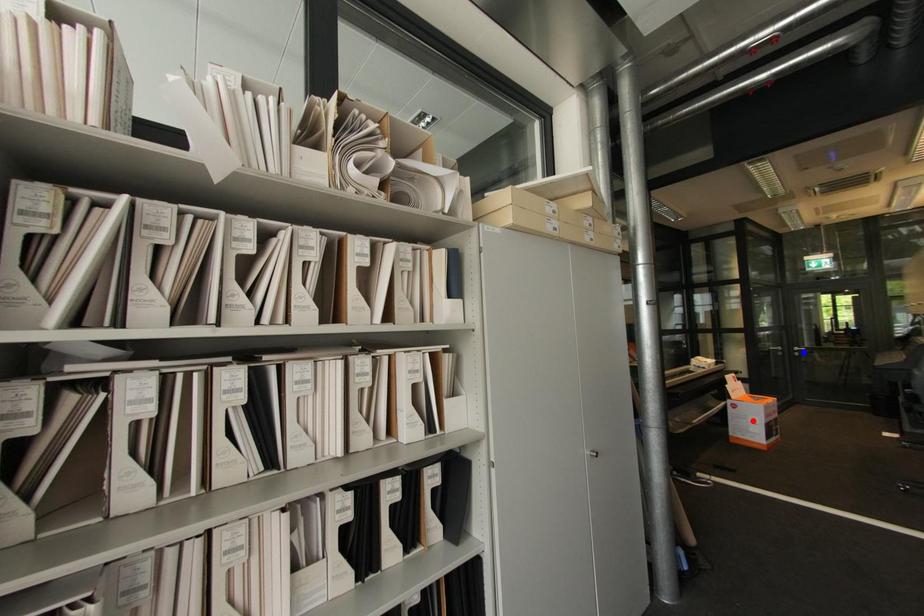
Question: Two points are marked on the image. Which point is closer to the camera?

Choices:
 (A) Blue point is closer.
 (B) Red point is closer.

Answer: (B)